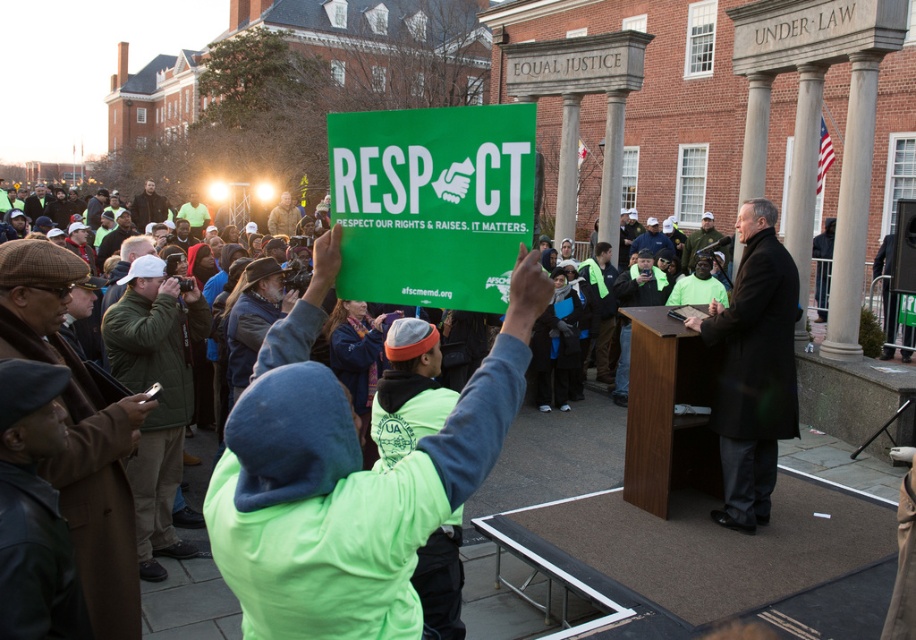
Question: Can you confirm if neon green jacket at center is bigger than black coat at center?

Choices:
 (A) yes
 (B) no

Answer: (B)

Question: Can you confirm if neon green jacket at center is bigger than black coat at center?

Choices:
 (A) yes
 (B) no

Answer: (B)

Question: Does neon green jacket at center have a smaller size compared to black coat at center?

Choices:
 (A) no
 (B) yes

Answer: (B)

Question: Among these objects, which one is farthest from the camera?

Choices:
 (A) black coat at center
 (B) neon green jacket at center

Answer: (A)

Question: Among these points, which one is nearest to the camera?

Choices:
 (A) (464, 413)
 (B) (772, 461)

Answer: (A)